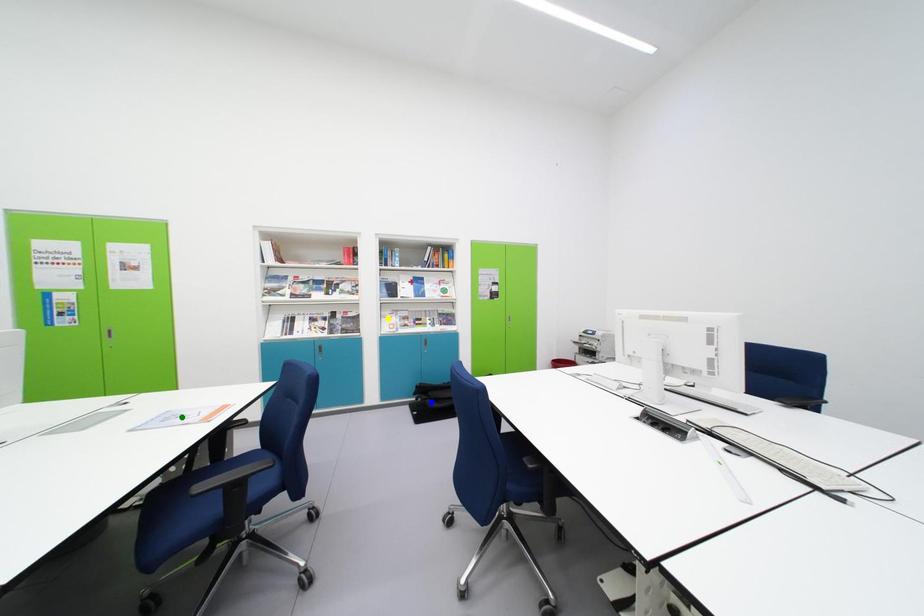
Order these from nearest to farthest:
green point
yellow point
blue point

yellow point, blue point, green point